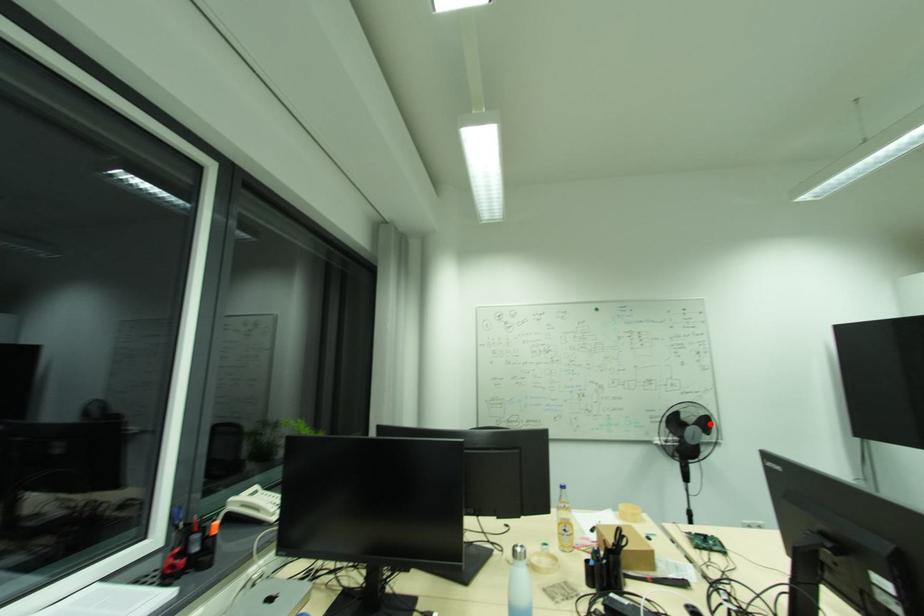
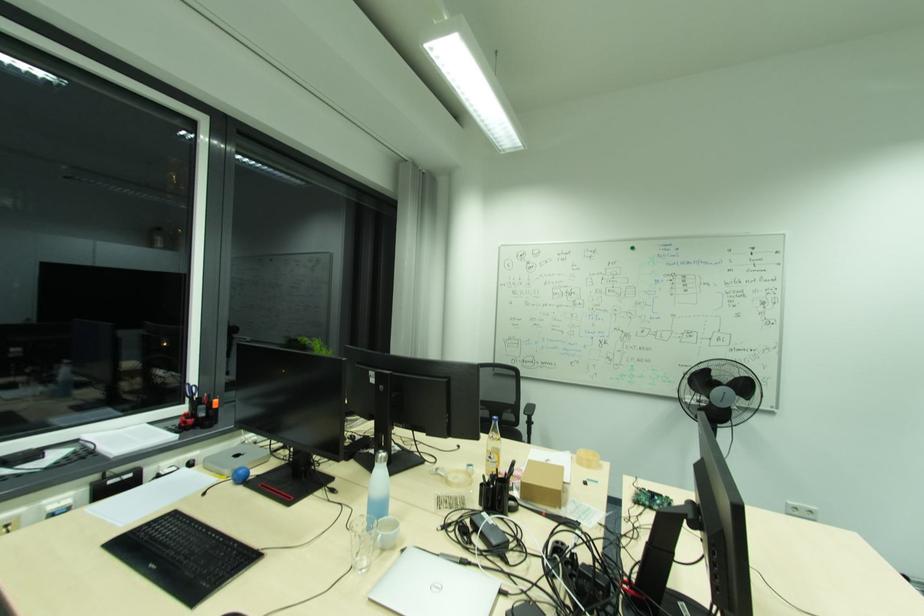
Find the pixel in the second image that matches the highlighted location in the first image.

(748, 387)